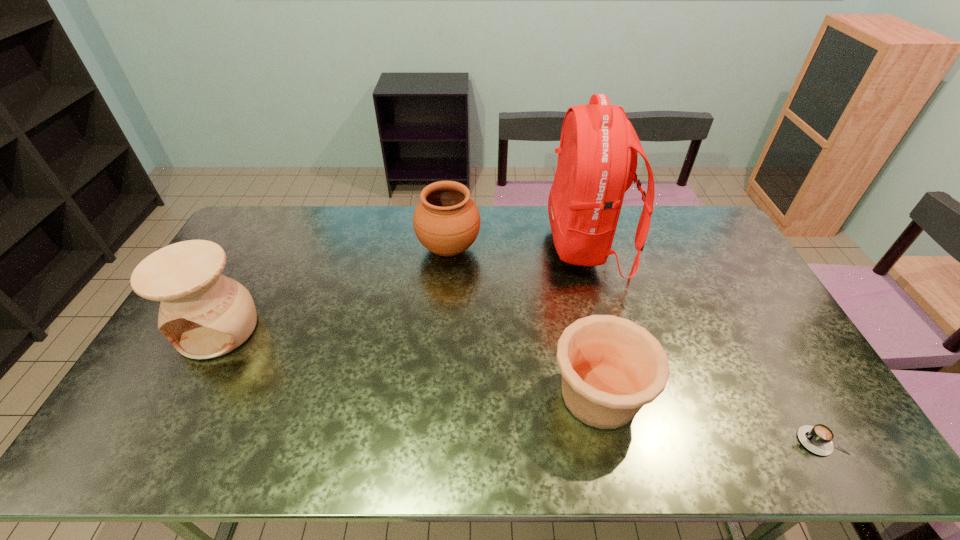
The image size is (960, 540). Find the location of `cappuccino situated at the near edge`. cappuccino situated at the near edge is located at coordinates [818, 439].

Where is `object that is at the left edge`? This screenshot has width=960, height=540. object that is at the left edge is located at coordinates (204, 314).

The width and height of the screenshot is (960, 540). Find the location of `object that is positioned at the right edge`. object that is positioned at the right edge is located at coordinates click(818, 439).

The width and height of the screenshot is (960, 540). Find the location of `object located at the near right corner`. object located at the near right corner is located at coordinates (818, 439).

You are a GUI agent. You are given a task and a screenshot of the screen. Output one action in this format:
    pyautogui.click(x=<x>, y=<y>)
    Task: Click on the vacant space at the far edge of the desktop
    
    Given the screenshot: What is the action you would take?
    pyautogui.click(x=503, y=222)

Identify the location of vacant space at the near edge of the desktop. (737, 433).

Locate an element on the screen. This screenshot has height=540, width=960. vacant space at the left edge of the desktop is located at coordinates (167, 403).

You are a GUI agent. You are given a task and a screenshot of the screen. Output one action in this format:
    pyautogui.click(x=<x>, y=<y>)
    Task: Click on the vacant space at the right edge of the desktop
    The width and height of the screenshot is (960, 540).
    Given the screenshot: What is the action you would take?
    pyautogui.click(x=730, y=267)

Locate an element on the screen. The width and height of the screenshot is (960, 540). vacant region at the near left corner of the desktop is located at coordinates (123, 447).

The image size is (960, 540). Find the location of `free space between the backpack and the second pottery from left to right`. free space between the backpack and the second pottery from left to right is located at coordinates (517, 247).